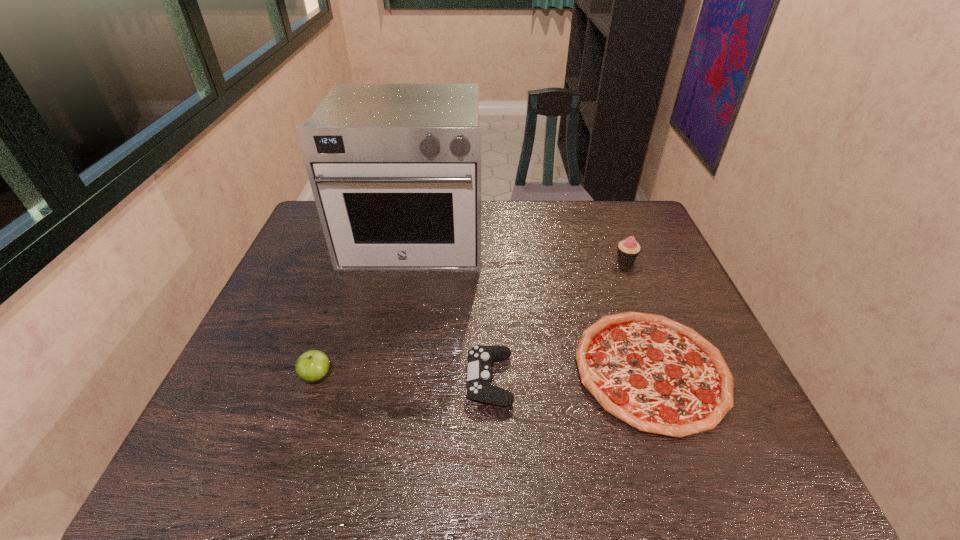
Find the location of a particular element. This screenshot has width=960, height=540. toaster oven is located at coordinates (395, 169).

I want to click on cupcake, so click(x=628, y=249).

What are the coordinates of `apple` in the screenshot? It's located at (313, 365).

Identify the location of control. (479, 377).

Find the location of a particular element. This screenshot has width=960, height=540. pizza is located at coordinates (659, 376).

At what (x,y) coordinates should I click in order to perform the action: click on vacant space situated 0.120m on the front panel of the tallest object. Please return your answer as a coordinate pair (x, y). The height and width of the screenshot is (540, 960). Looking at the image, I should click on (401, 305).

Where is `blank space located 0.220m on the left of the cupcake`? The height and width of the screenshot is (540, 960). blank space located 0.220m on the left of the cupcake is located at coordinates (543, 260).

Where is `vacant space positioned 0.210m on the front of the apple`? vacant space positioned 0.210m on the front of the apple is located at coordinates (280, 482).

This screenshot has width=960, height=540. I want to click on vacant space situated 0.160m on the surface of the control, so click(397, 379).

Identify the location of vacant space situated on the surface of the control. (444, 379).